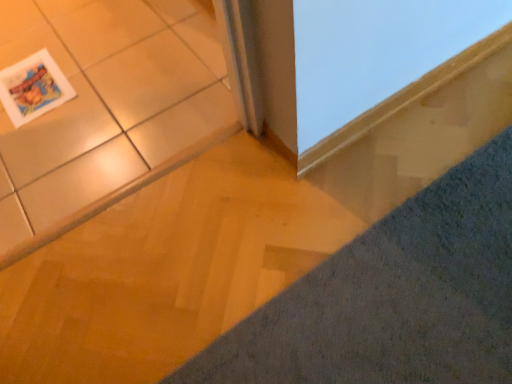
Question: Can you confirm if gray textured carpet at lower right is smaller than smooth wood frame at upper right?

Choices:
 (A) no
 (B) yes

Answer: (A)

Question: Is gray textured carpet at lower right further to camera compared to smooth wood frame at upper right?

Choices:
 (A) yes
 (B) no

Answer: (B)

Question: Considering the relative sizes of gray textured carpet at lower right and smooth wood frame at upper right in the image provided, is gray textured carpet at lower right thinner than smooth wood frame at upper right?

Choices:
 (A) yes
 (B) no

Answer: (B)

Question: Is gray textured carpet at lower right not inside smooth wood frame at upper right?

Choices:
 (A) yes
 (B) no

Answer: (A)

Question: Is gray textured carpet at lower right bigger than smooth wood frame at upper right?

Choices:
 (A) no
 (B) yes

Answer: (B)

Question: In terms of width, does matte ceramic tile at upper left look wider or thinner when compared to smooth wood frame at upper right?

Choices:
 (A) wide
 (B) thin

Answer: (A)

Question: Considering the positions of point (x=115, y=84) and point (x=421, y=34), is point (x=115, y=84) closer or farther from the camera than point (x=421, y=34)?

Choices:
 (A) farther
 (B) closer

Answer: (A)

Question: Is matte ceramic tile at upper left bigger or smaller than smooth wood frame at upper right?

Choices:
 (A) big
 (B) small

Answer: (A)

Question: In the image, is matte ceramic tile at upper left on the left side or the right side of smooth wood frame at upper right?

Choices:
 (A) right
 (B) left

Answer: (B)

Question: Considering the positions of matte paper magazine at upper left and smooth wood frame at upper right in the image, is matte paper magazine at upper left taller or shorter than smooth wood frame at upper right?

Choices:
 (A) short
 (B) tall

Answer: (A)

Question: From a real-world perspective, is matte paper magazine at upper left physically located above or below smooth wood frame at upper right?

Choices:
 (A) above
 (B) below

Answer: (B)

Question: Considering their positions, is matte paper magazine at upper left located in front of or behind smooth wood frame at upper right?

Choices:
 (A) front
 (B) behind

Answer: (B)

Question: Is matte paper magazine at upper left wider or thinner than smooth wood frame at upper right?

Choices:
 (A) thin
 (B) wide

Answer: (B)

Question: Considering the positions of matte paper magazine at upper left and gray textured carpet at lower right in the image, is matte paper magazine at upper left wider or thinner than gray textured carpet at lower right?

Choices:
 (A) wide
 (B) thin

Answer: (B)

Question: In terms of height, does matte paper magazine at upper left look taller or shorter compared to gray textured carpet at lower right?

Choices:
 (A) short
 (B) tall

Answer: (A)